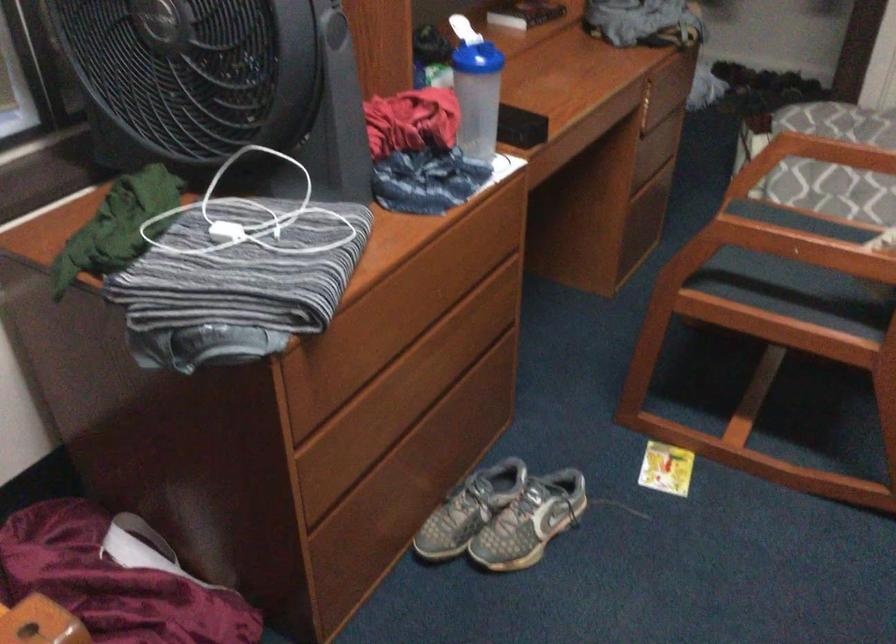
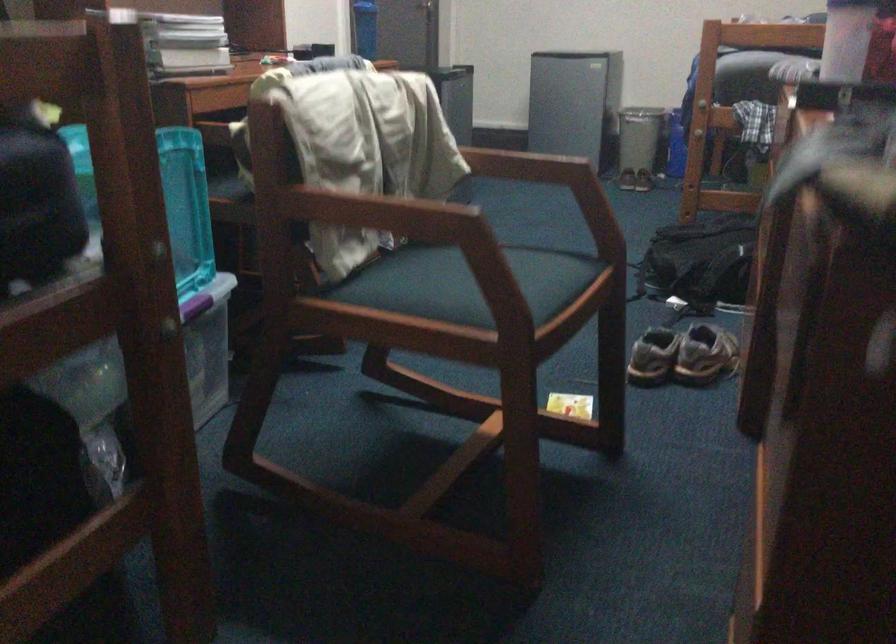
Locate, in the second image, the point that corresponds to point 533,474 in the first image.

(682, 355)